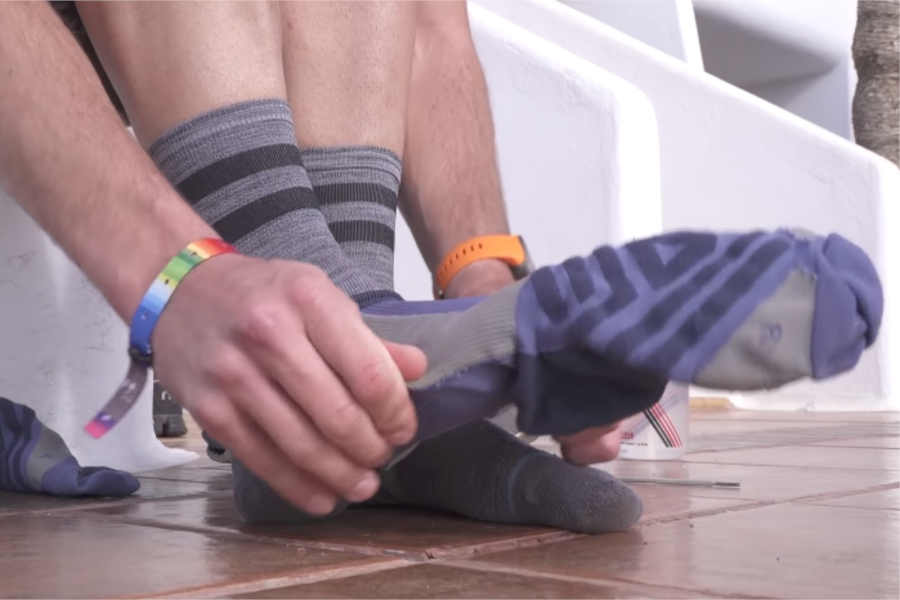
Identify the location of floor. (801, 563).